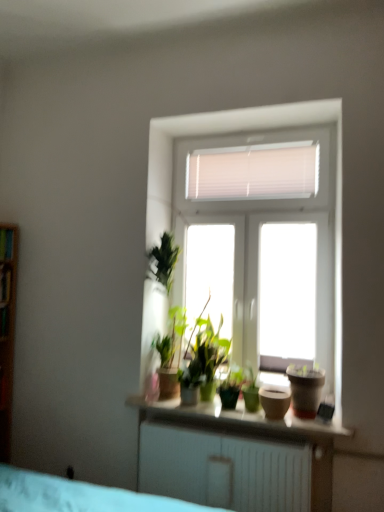
Question: Would you consider matte brown pot at right, positioned as the first flowerpot in right-to-left order, to be distant from wooden shelf at left, positioned as the 1th shelf in bottom-to-top order?

Choices:
 (A) yes
 (B) no

Answer: (A)

Question: Is matte brown pot at right, which is counted as the second flowerpot, starting from the left, beside wooden shelf at left, positioned as the 1th shelf in bottom-to-top order?

Choices:
 (A) yes
 (B) no

Answer: (B)

Question: Is matte brown pot at right, which is counted as the second flowerpot, starting from the left, shorter than wooden shelf at left, positioned as the 1th shelf in bottom-to-top order?

Choices:
 (A) no
 (B) yes

Answer: (A)

Question: Is the position of matte brown pot at right, which is counted as the second flowerpot, starting from the left, more distant than that of wooden shelf at left, positioned as the 1th shelf in bottom-to-top order?

Choices:
 (A) yes
 (B) no

Answer: (B)

Question: From the image's perspective, would you say matte brown pot at right, which is counted as the second flowerpot, starting from the left, is positioned over wooden shelf at left, positioned as the 1th shelf in bottom-to-top order?

Choices:
 (A) yes
 (B) no

Answer: (B)

Question: From the image's perspective, is green matte houseplant at center positioned above or below wooden shelf at left, which is the 2th shelf in top-to-bottom order?

Choices:
 (A) below
 (B) above

Answer: (A)

Question: Would you say green matte houseplant at center is to the left or to the right of wooden shelf at left, positioned as the 1th shelf in bottom-to-top order, in the picture?

Choices:
 (A) right
 (B) left

Answer: (A)

Question: Is green matte houseplant at center taller or shorter than wooden shelf at left, which is the 2th shelf in top-to-bottom order?

Choices:
 (A) tall
 (B) short

Answer: (A)

Question: Is green matte houseplant at center situated inside wooden shelf at left, which is the 2th shelf in top-to-bottom order, or outside?

Choices:
 (A) outside
 (B) inside

Answer: (A)

Question: Is wooden shelf at left, arranged as the second shelf when ordered from the bottom, taller or shorter than matte brown pot at right, positioned as the first flowerpot in right-to-left order?

Choices:
 (A) short
 (B) tall

Answer: (A)

Question: From a real-world perspective, is wooden shelf at left, placed as the first shelf when sorted from top to bottom, above or below matte brown pot at right, which is counted as the second flowerpot, starting from the left?

Choices:
 (A) above
 (B) below

Answer: (A)

Question: Is wooden shelf at left, placed as the first shelf when sorted from top to bottom, wider or thinner than matte brown pot at right, positioned as the first flowerpot in right-to-left order?

Choices:
 (A) thin
 (B) wide

Answer: (A)

Question: Is point (8, 240) closer or farther from the camera than point (296, 396)?

Choices:
 (A) closer
 (B) farther

Answer: (B)

Question: From a real-world perspective, is matte brown pot at right, which is counted as the second flowerpot, starting from the left, above or below wooden shelf at left, placed as the first shelf when sorted from top to bottom?

Choices:
 (A) below
 (B) above

Answer: (A)

Question: Would you say matte brown pot at right, which is counted as the second flowerpot, starting from the left, is inside or outside wooden shelf at left, placed as the first shelf when sorted from top to bottom?

Choices:
 (A) outside
 (B) inside

Answer: (A)